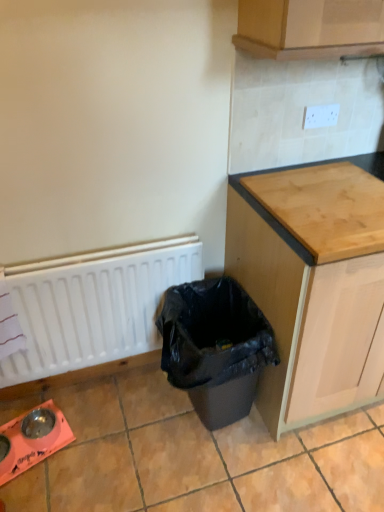
I want to click on vacant space to the left of black plastic waste bin at lower center, so click(x=118, y=431).